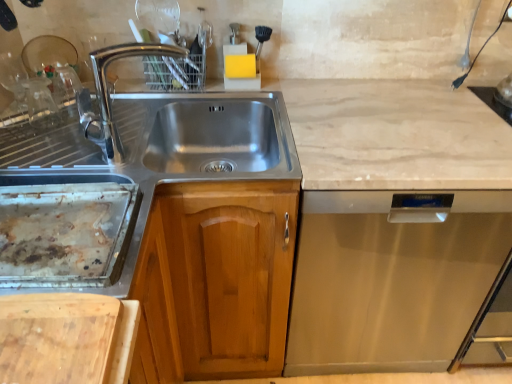
This screenshot has width=512, height=384. Identify the location of free point above rusty metal tray at left (from a real-world perspective). (52, 223).